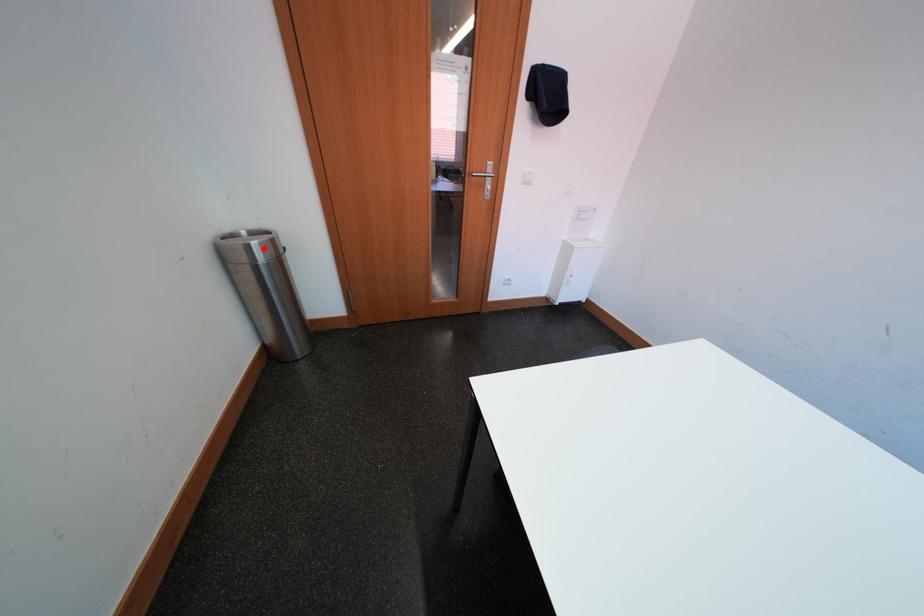
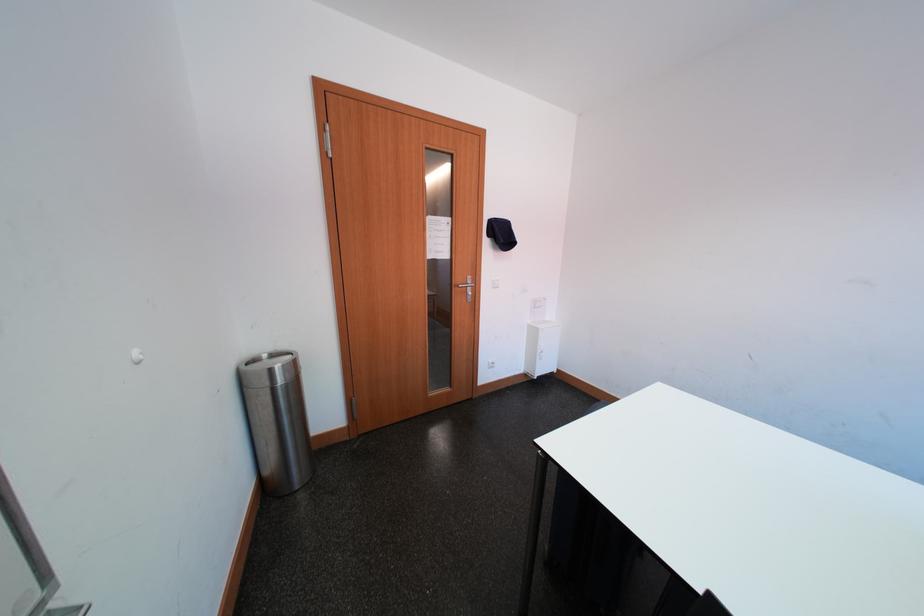
The point at the highlighted location is marked in the first image. Where is the corresponding point in the second image?

(286, 370)